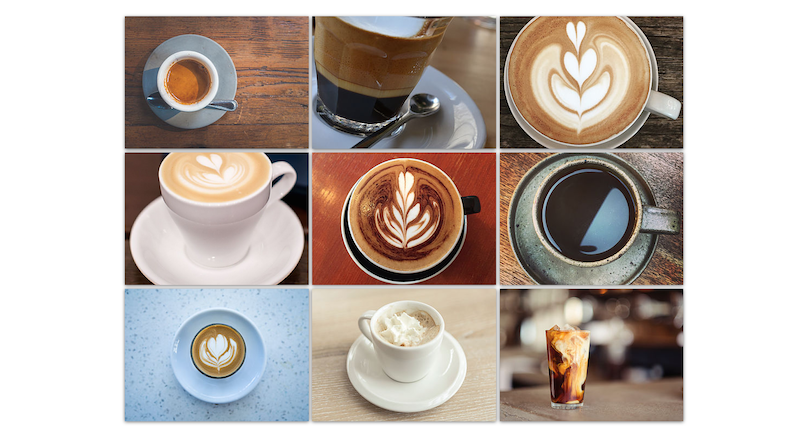
This screenshot has height=436, width=800. Identify the location of saucers. (405, 396), (256, 360), (621, 275), (412, 280), (266, 254), (206, 116), (454, 130), (632, 133).